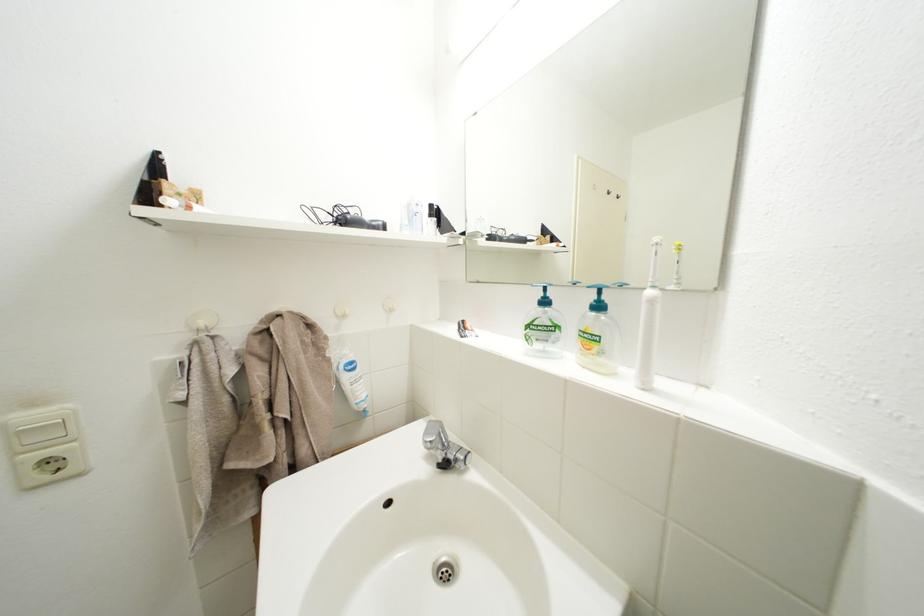
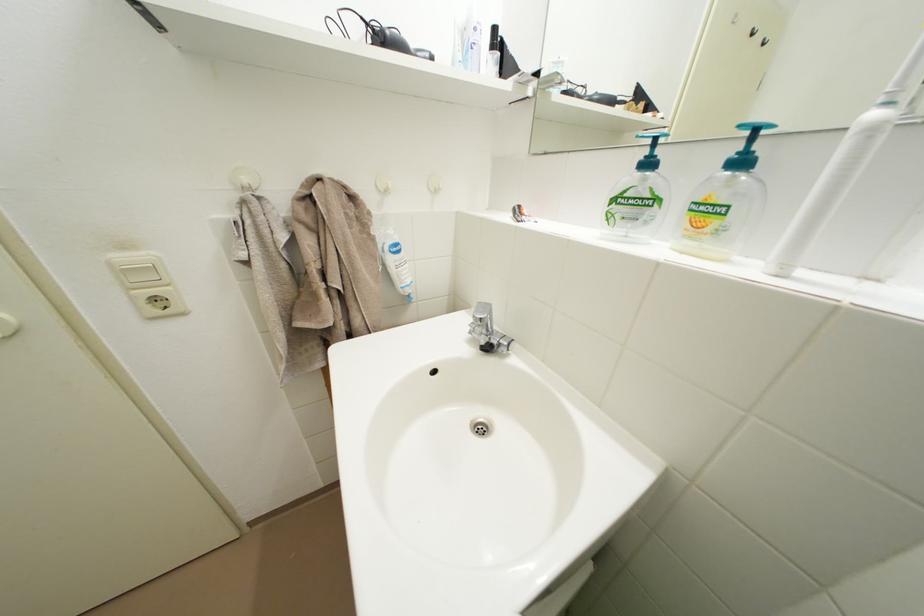
Question: The first image is from the beginning of the video and the second image is from the end. How did the camera likely rotate when shooting the video?

Choices:
 (A) Left
 (B) Right
 (C) Up
 (D) Down

Answer: (D)